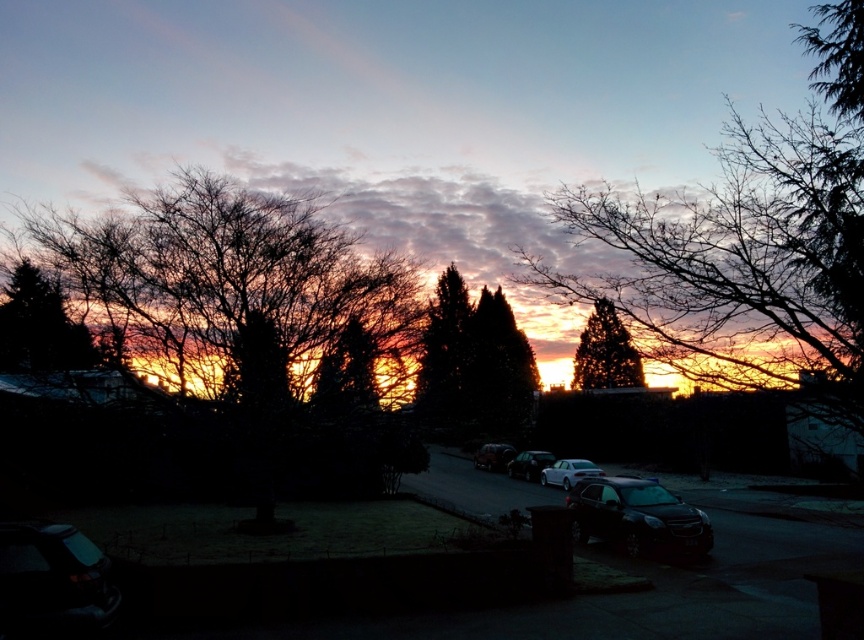
Identify the location of glossy black car at center. pyautogui.click(x=637, y=516).

Is glossy black car at center wider than green matte tree at left?

Indeed, glossy black car at center has a greater width compared to green matte tree at left.

Is point (691, 524) more distant than point (10, 285)?

Yes.

The height and width of the screenshot is (640, 864). Identify the location of glossy black car at center. (637, 516).

Can you confirm if satin silver sedan at center is positioned to the right of satin black car at center?

Yes, satin silver sedan at center is to the right of satin black car at center.

Between satin silver sedan at center and satin black car at center, which one is positioned higher?

satin black car at center is higher up.

Is point (569, 481) closer to viewer compared to point (540, 454)?

Yes, point (569, 481) is in front of point (540, 454).

At what (x,y) coordinates should I click in order to perform the action: click on satin silver sedan at center. Please return your answer as a coordinate pair (x, y). The image size is (864, 640). Looking at the image, I should click on (569, 472).

Does green matte tree at center have a lesser height compared to green textured pine tree at center?

No, green matte tree at center is not shorter than green textured pine tree at center.

Which is above, green matte tree at center or green textured pine tree at center?

Positioned higher is green matte tree at center.

Between point (452, 310) and point (585, 369), which one is positioned in front?

Point (585, 369) is in front.

At what (x,y) coordinates should I click in order to perform the action: click on green matte tree at center. Please return your answer as a coordinate pair (x, y). The image size is (864, 640). Looking at the image, I should click on (443, 352).